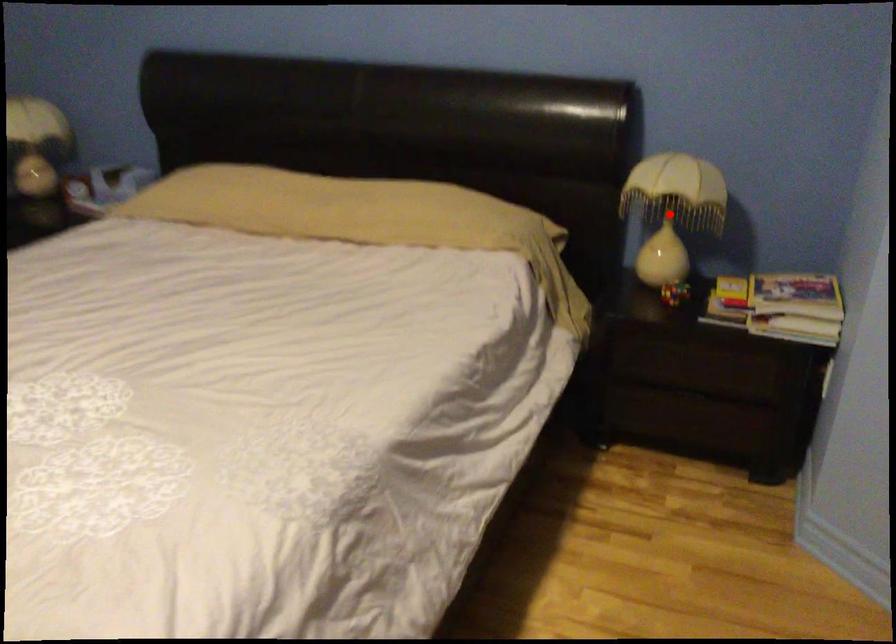
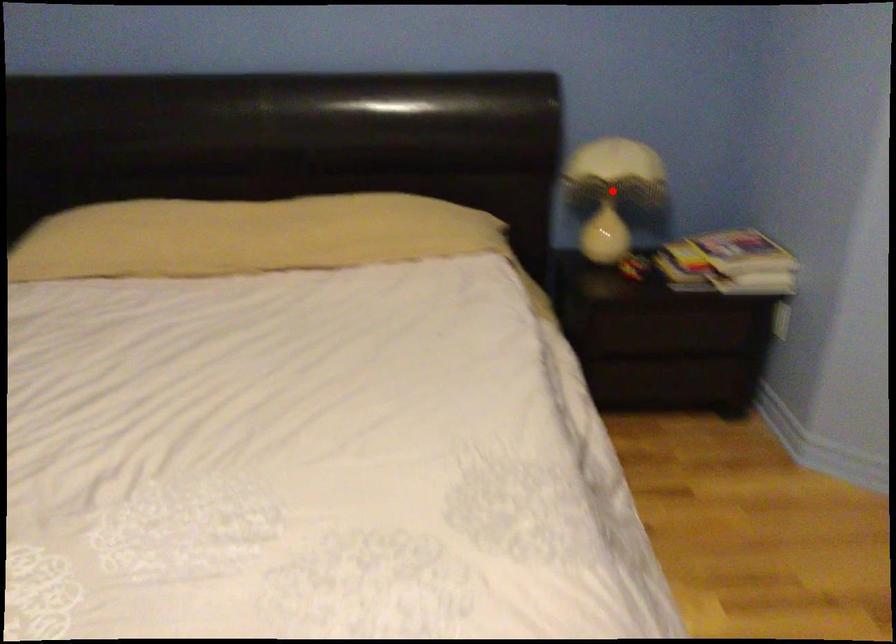
I am providing you with two images of the same scene from different viewpoints. A red point is marked on the first image and another point is marked on the second image. Do the highlighted points in image1 and image2 indicate the same real-world spot?

Yes